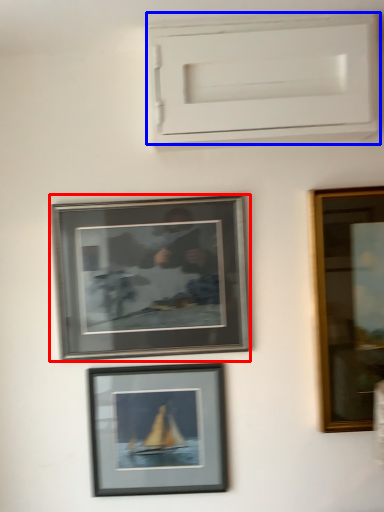
Question: Which of the following is the farthest to the observer, picture frame (highlighted by a red box) or window frame (highlighted by a blue box)?

Choices:
 (A) picture frame
 (B) window frame

Answer: (A)